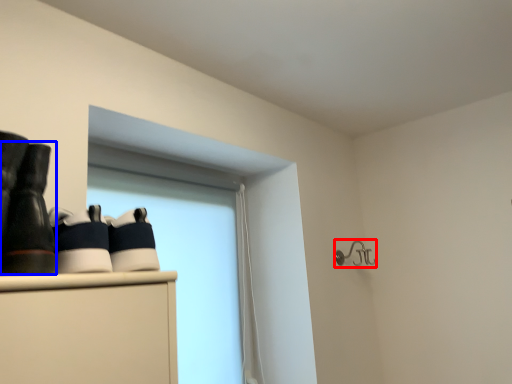
Question: Which of the following is the farthest to the observer, shower (highlighted by a red box) or footwear (highlighted by a blue box)?

Choices:
 (A) shower
 (B) footwear

Answer: (A)